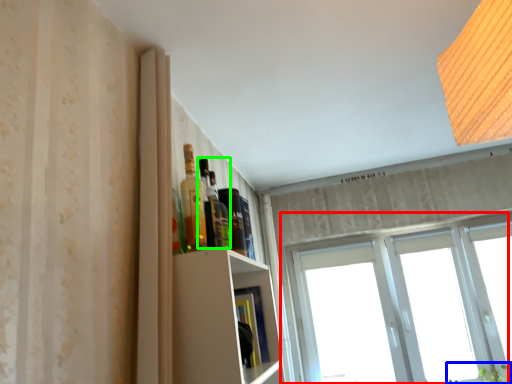
Question: Estimate the real-world distances between objects in this image. Which object is closer to window (highlighted by a red box), plant (highlighted by a blue box) or bottle (highlighted by a green box)?

Choices:
 (A) plant
 (B) bottle

Answer: (A)